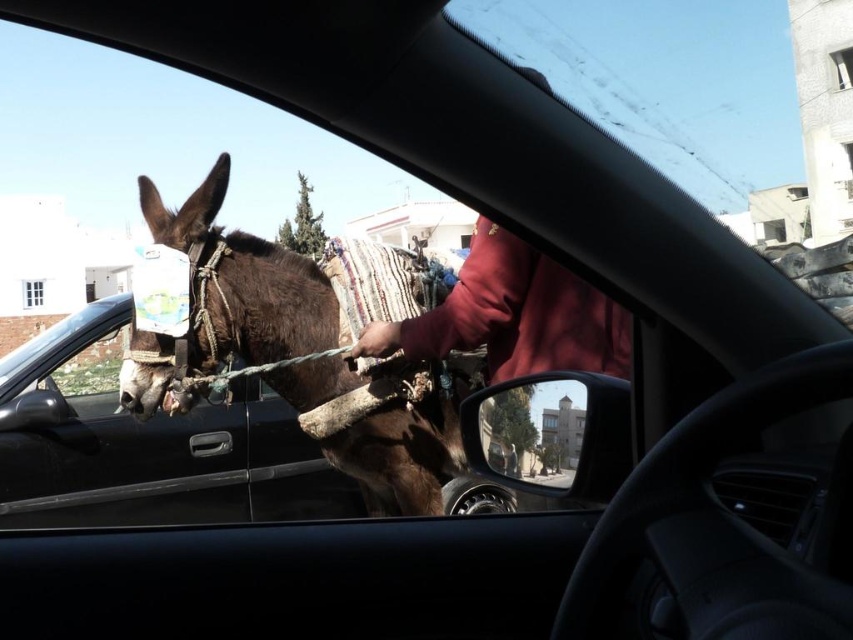
In the scene shown: You are a driver in a car and want to know if the brown fuzzy mule at left can fit through a narrow alley next to the red fleece jacket at center. Can it fit based on their widths?

The brown fuzzy mule at left is wider than the red fleece jacket at center, so it may not fit through the narrow alley next to the red fleece jacket at center unless the alley is wide enough to accommodate its greater width.